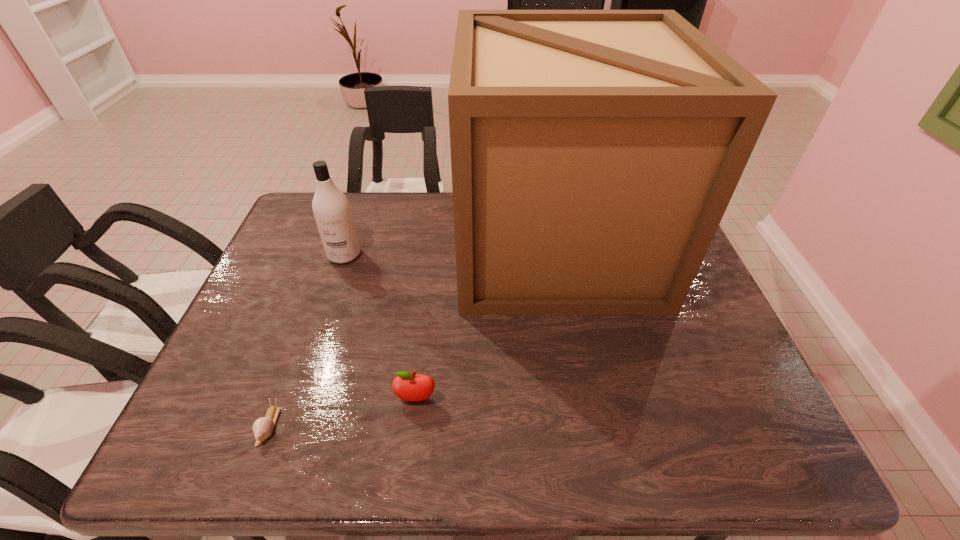
Find the location of a particular element. This screenshot has height=540, width=960. free spot that satisfies the following two spatial constraints: 1. on the reinforced sides of the box; 2. on the front-facing side of the shampoo is located at coordinates (557, 254).

Locate an element on the screen. The height and width of the screenshot is (540, 960). vacant space that satisfies the following two spatial constraints: 1. on the reinforced sides of the box; 2. on the front side of the second object from right to left is located at coordinates (585, 399).